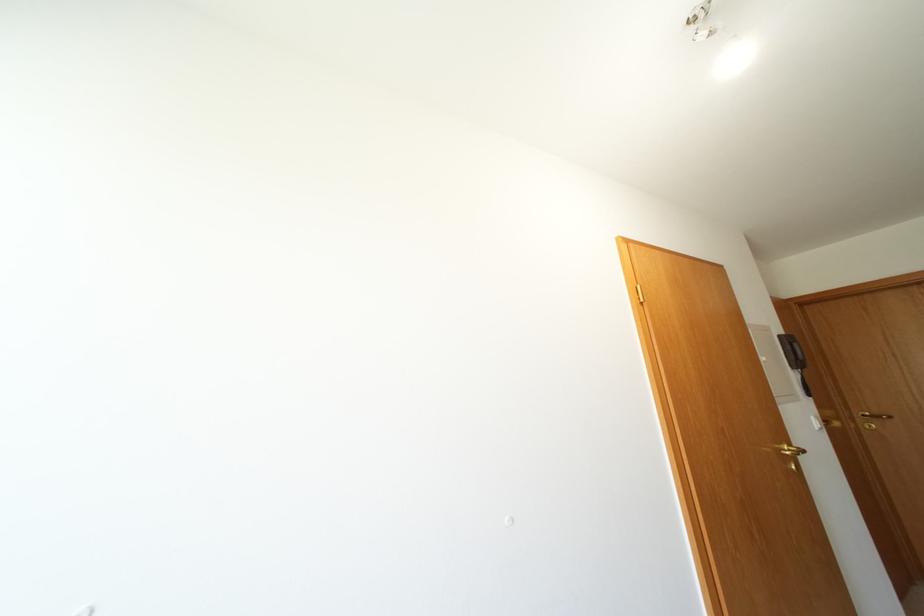
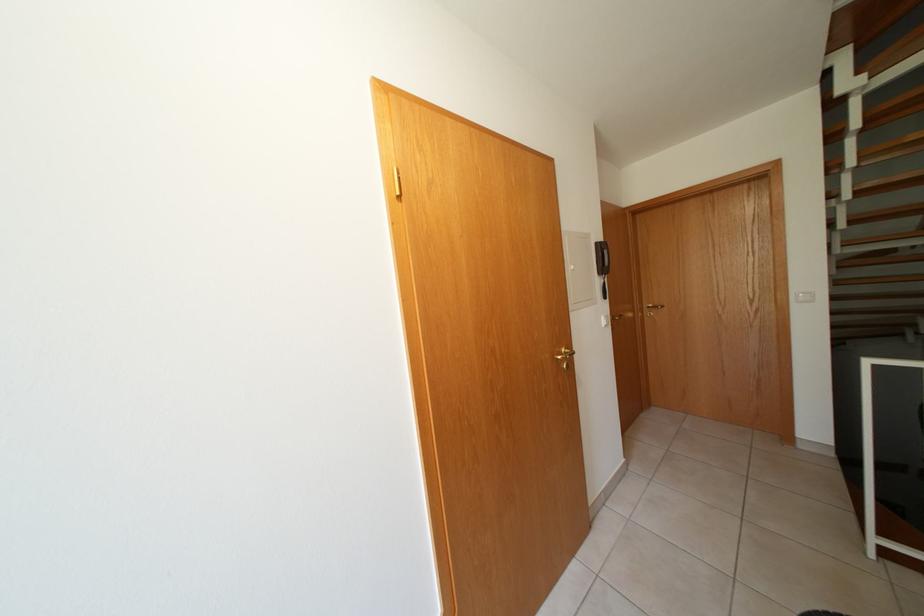
What movement of the cameraman would produce the second image?

The cameraman moved toward right, forward.